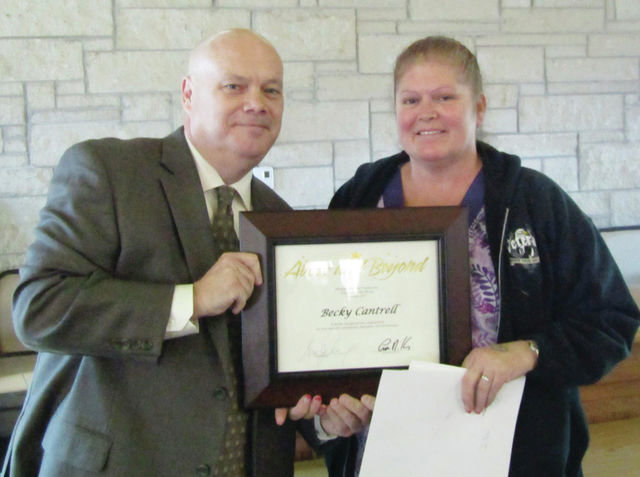
Identify the location of floor. (626, 453).